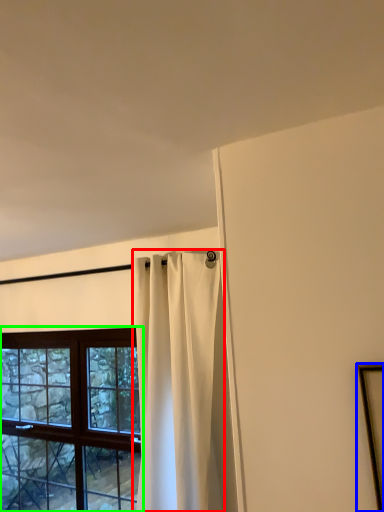
Question: Which object is positioned farthest from curtain (highlighted by a red box)? Select from picture frame (highlighted by a blue box) and window (highlighted by a green box).

Choices:
 (A) picture frame
 (B) window

Answer: (A)